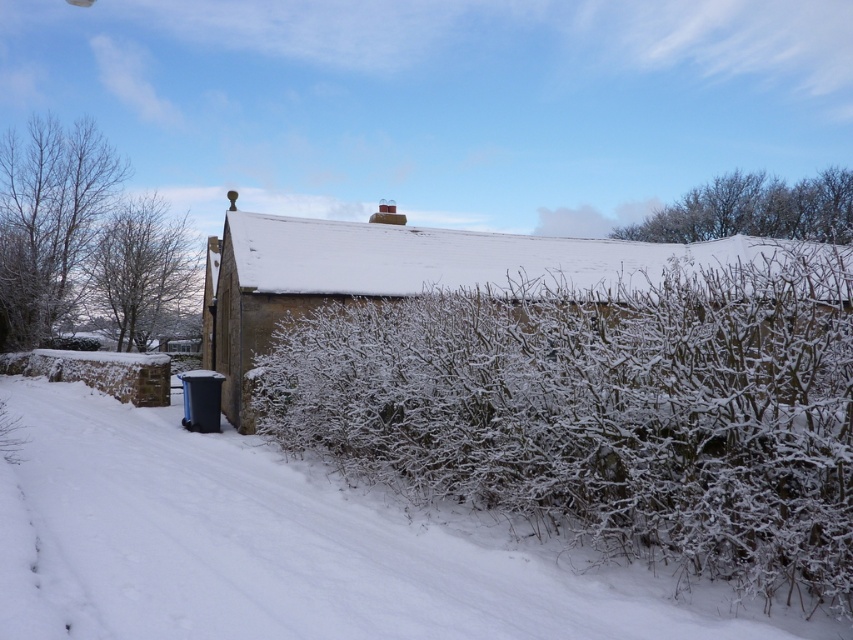
Where is `white frosted hedge at center`? The height and width of the screenshot is (640, 853). white frosted hedge at center is located at coordinates (604, 410).

At what (x,y) coordinates should I click in order to perform the action: click on white frosted hedge at center. Please return your answer as a coordinate pair (x, y). Looking at the image, I should click on (604, 410).